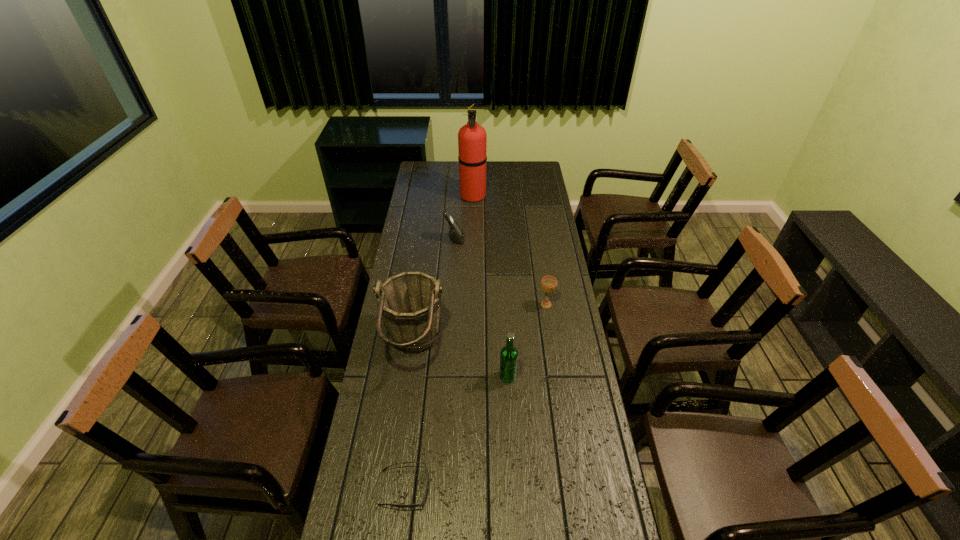
Locate an element on the screen. This screenshot has height=540, width=960. vacant area that satisfies the following two spatial constraints: 1. at the nozzle of the beer bottle; 2. on the right side of the farthest object is located at coordinates (469, 376).

I want to click on free space that satisfies the following two spatial constraints: 1. on the back side of the third tallest object; 2. on the handle side of the bucket, so click(x=506, y=346).

Where is `free spot that satisfies the following two spatial constraints: 1. on the back side of the chalice; 2. on the front-facing side of the fifth nearest object`? free spot that satisfies the following two spatial constraints: 1. on the back side of the chalice; 2. on the front-facing side of the fifth nearest object is located at coordinates (537, 240).